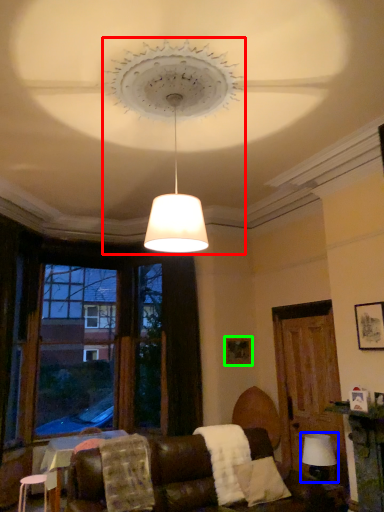
Question: Which object is the farthest from lighting (highlighted by a red box)? Choose among these: table lamp (highlighted by a blue box) or picture frame (highlighted by a green box).

Choices:
 (A) table lamp
 (B) picture frame

Answer: (A)